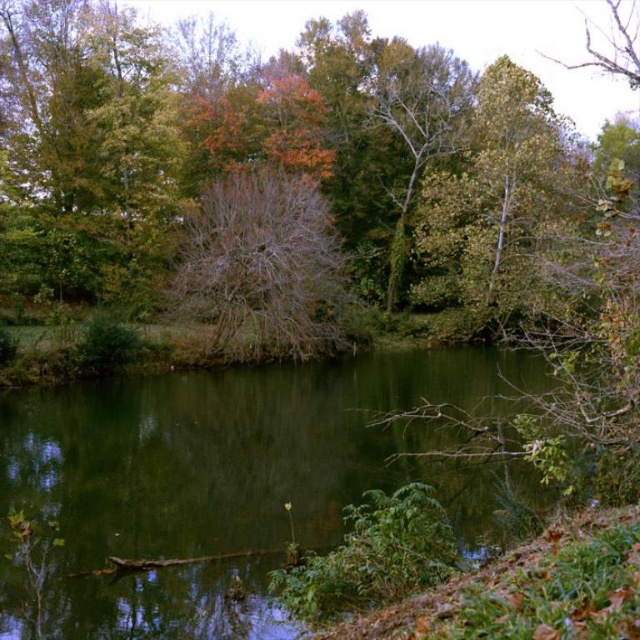
Can you confirm if green liquid water at center is wider than bare branches at center?

Indeed, green liquid water at center has a greater width compared to bare branches at center.

Is green liquid water at center further to the viewer compared to bare branches at center?

No, it is not.

Between point (390, 480) and point (285, 260), which one is positioned behind?

Positioned behind is point (285, 260).

Locate an element on the screen. green liquid water at center is located at coordinates (227, 483).